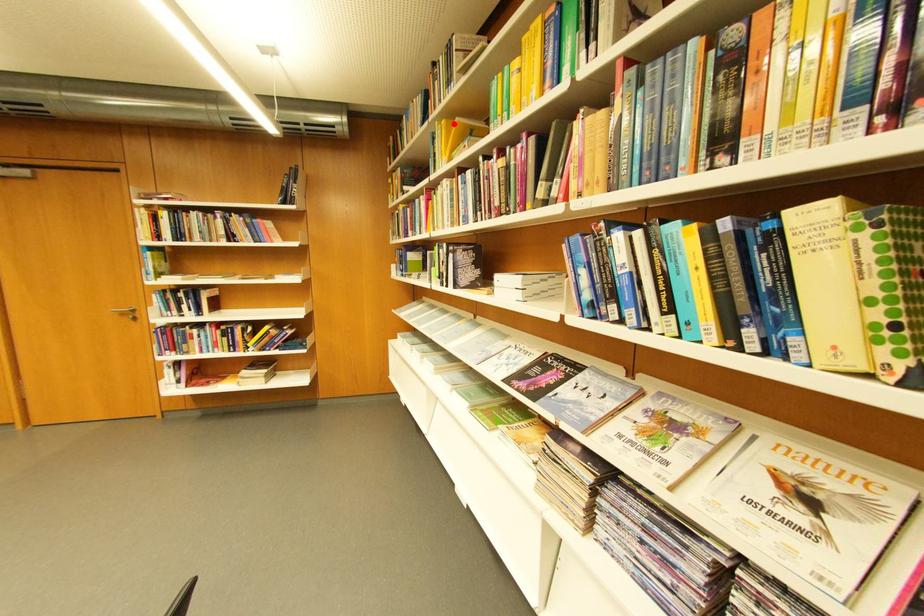
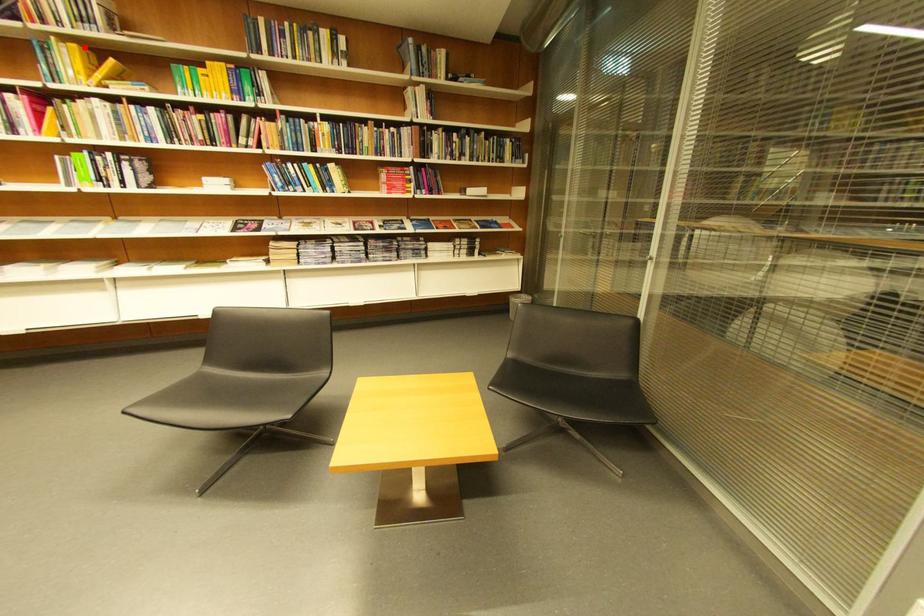
I am providing you with two images of the same scene from different viewpoints. A red point is marked on the first image and another point is marked on the second image. Do the highlighted points in image1 and image2 indicate the same real-world spot?

Yes